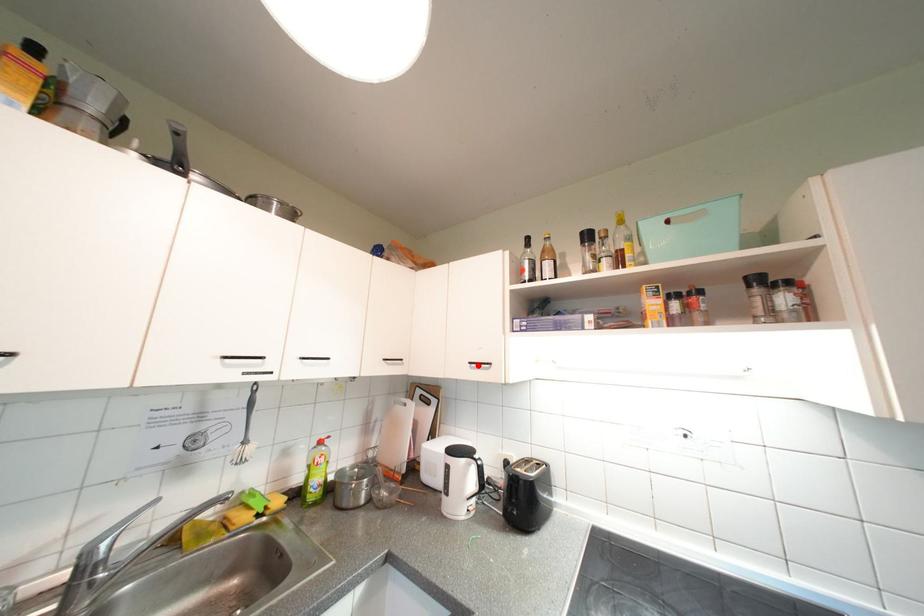
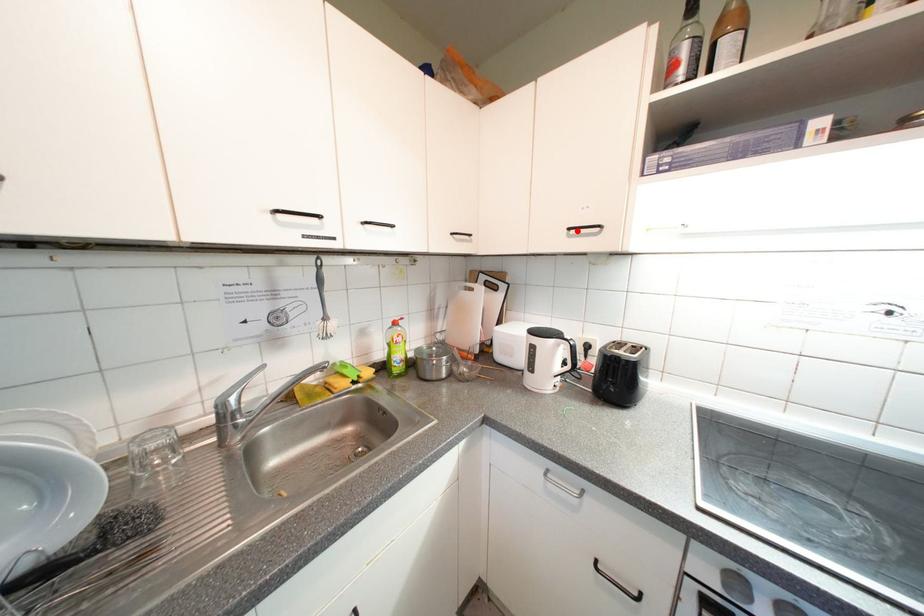
I am providing you with two images of the same scene from different viewpoints. A red point is marked on the first image and another point is marked on the second image. Does the point marked in image1 correspond to the same location as the one in image2?

Yes